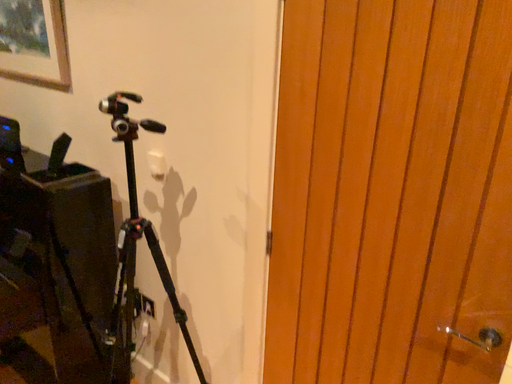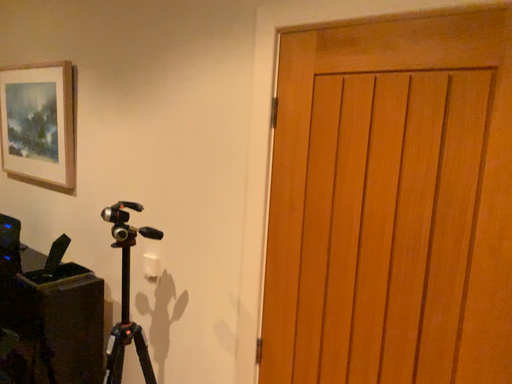
Question: Which way did the camera rotate in the video?

Choices:
 (A) rotated upward
 (B) rotated downward

Answer: (A)